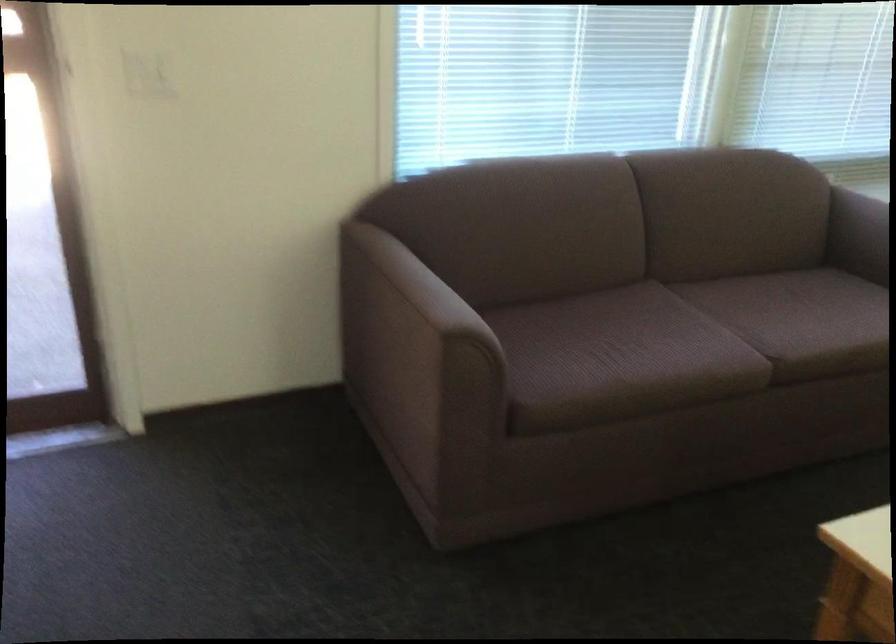
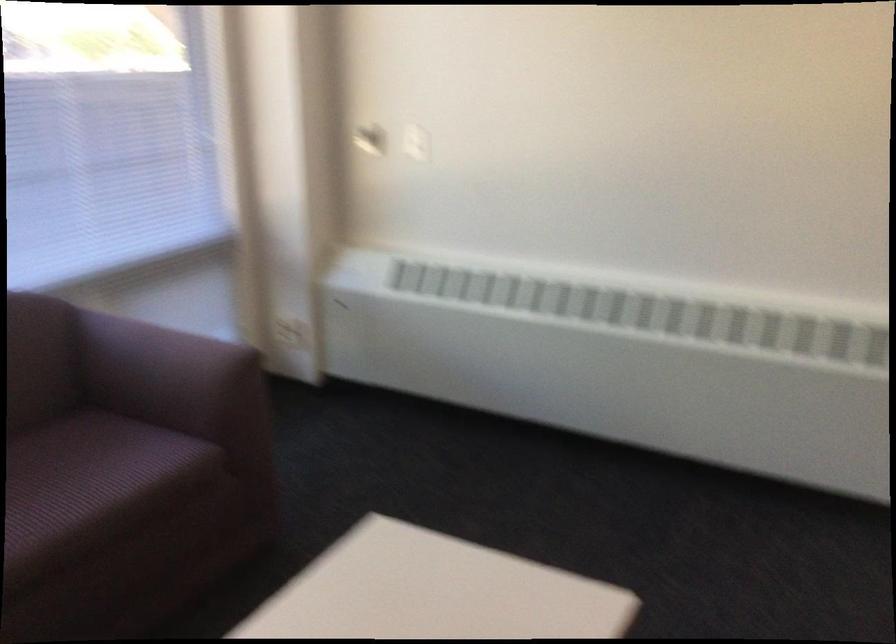
Question: The camera is either moving clockwise (left) or counter-clockwise (right) around the object. The first image is from the beginning of the video and the second image is from the end. Is the camera moving left or right when shooting the video?

Choices:
 (A) Left
 (B) Right

Answer: (A)